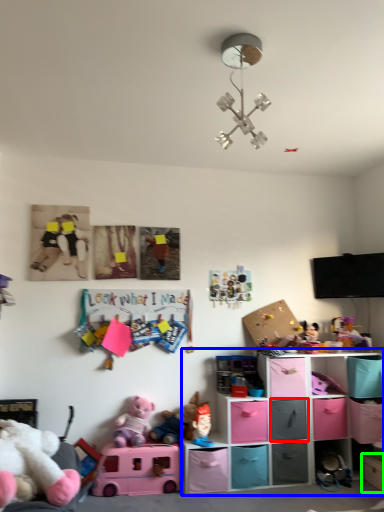
Question: Considering the real-world distances, which object is closest to shelf (highlighted by a red box)? shelf (highlighted by a blue box) or shelf (highlighted by a green box).

Choices:
 (A) shelf
 (B) shelf

Answer: (A)